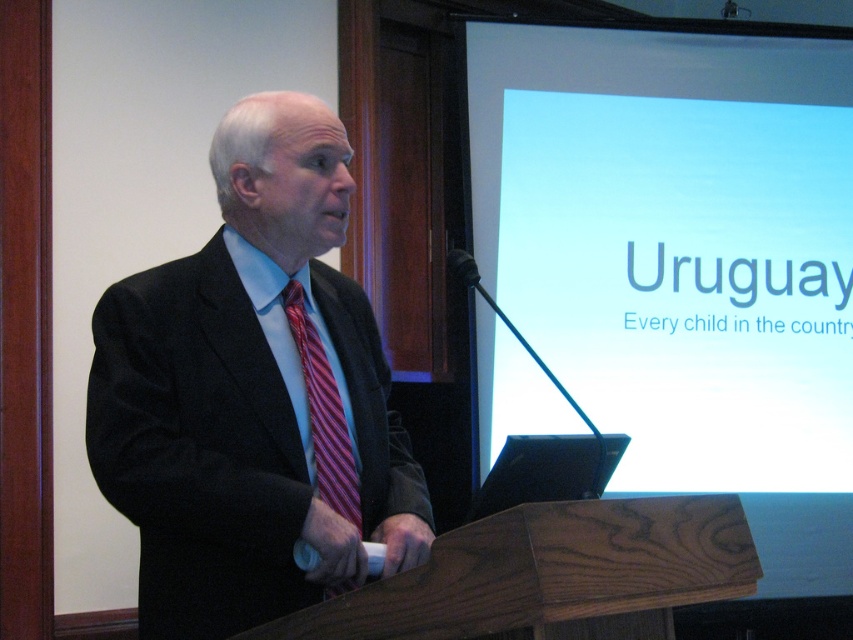
Which is above, white glossy screen at upper center or striped silk tie at center?

white glossy screen at upper center

Between white glossy screen at upper center and striped silk tie at center, which one is positioned lower?

striped silk tie at center

Is point (618, 154) closer to camera compared to point (347, 490)?

No, (618, 154) is further to viewer.

Identify the location of white glossy screen at upper center. The image size is (853, 640). (676, 241).

Who is higher up, white glossy screen at upper center or matte black suit at center?

white glossy screen at upper center is above.

Can you confirm if white glossy screen at upper center is bigger than matte black suit at center?

Indeed, white glossy screen at upper center has a larger size compared to matte black suit at center.

At what (x,y) coordinates should I click in order to perform the action: click on white glossy screen at upper center. Please return your answer as a coordinate pair (x, y). The width and height of the screenshot is (853, 640). Looking at the image, I should click on (676, 241).

Who is lower down, matte black suit at center or striped silk tie at center?

striped silk tie at center is lower down.

Measure the distance between matte black suit at center and striped silk tie at center.

matte black suit at center is 5.54 inches away from striped silk tie at center.

Does point (161, 618) come closer to viewer compared to point (318, 365)?

Yes, it is in front of point (318, 365).

Identify the location of matte black suit at center. The image size is (853, 640). (252, 394).